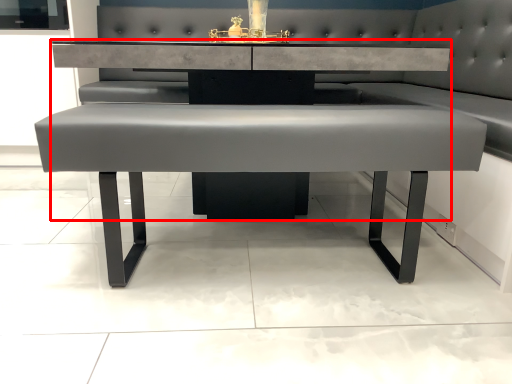
Question: From the image's perspective, considering the relative positions of table (annotated by the red box) and table in the image provided, where is table (annotated by the red box) located with respect to the staircase?

Choices:
 (A) above
 (B) below

Answer: (A)